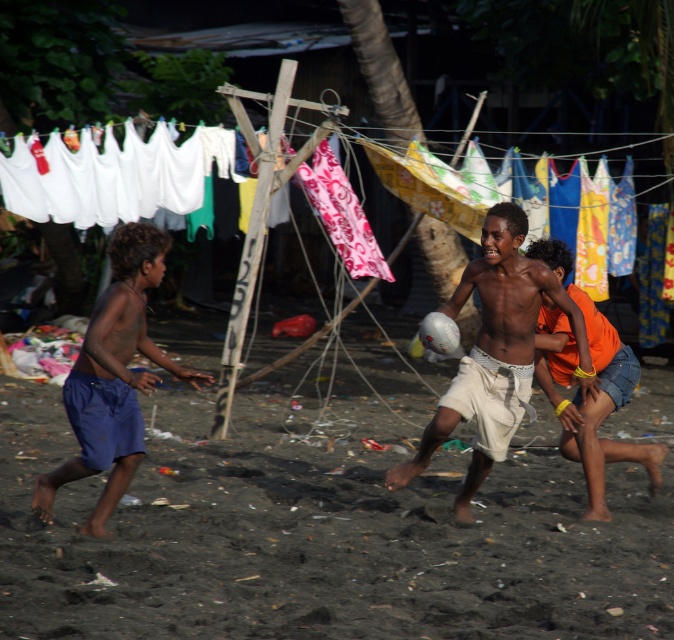
Question: Does white cotton shorts at center appear on the left side of orange fabric shorts at right?

Choices:
 (A) yes
 (B) no

Answer: (A)

Question: Can you confirm if blue cotton shorts at left is thinner than orange fabric shorts at right?

Choices:
 (A) no
 (B) yes

Answer: (A)

Question: Among these points, which one is nearest to the camera?

Choices:
 (A) 102,397
 (B) 514,326

Answer: (A)

Question: Is white cotton shorts at center bigger than blue cotton shorts at left?

Choices:
 (A) no
 (B) yes

Answer: (B)

Question: Which point is closer to the camera taking this photo?

Choices:
 (A) coord(38,529)
 (B) coord(125,448)

Answer: (B)

Question: Estimate the real-world distances between objects in this image. Which object is farther from the orange fabric shorts at right?

Choices:
 (A) white cotton shorts at center
 (B) blue cotton shorts at left
 (C) dark brown sand at center

Answer: (C)